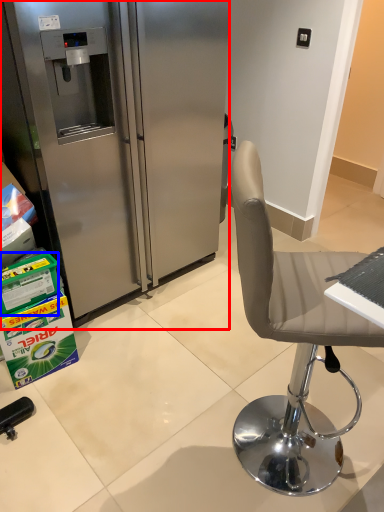
Question: Which point is closer to the camera, refrigerator (highlighted by a red box) or box (highlighted by a blue box)?

Choices:
 (A) refrigerator
 (B) box

Answer: (A)